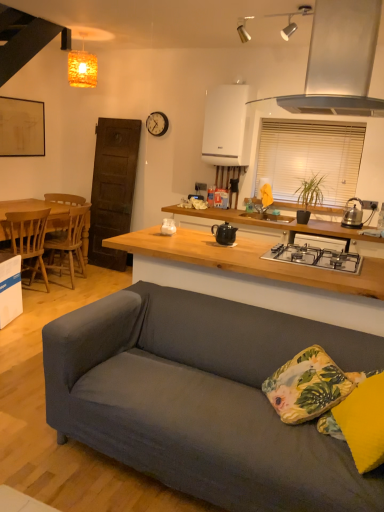
Measure the distance between wooden chair at left, which is counted as the first chair, starting from the front, and camera.

The distance of wooden chair at left, which is counted as the first chair, starting from the front, from camera is 12.43 feet.

I want to click on green matte plant at upper right, so click(x=309, y=197).

The image size is (384, 512). Identify the location of black ceramic teapot at center. (224, 233).

Locate an element on the screen. This screenshot has height=512, width=384. matte yellow pillow at lower right, the 2th pillow viewed from the back is located at coordinates (364, 422).

From a real-world perspective, is white glossy coffee cup at center beneath black ceramic teapot at center?

Correct, in the physical world, white glossy coffee cup at center is lower than black ceramic teapot at center.

Can you confirm if white glossy coffee cup at center is taller than black ceramic teapot at center?

No, white glossy coffee cup at center is not taller than black ceramic teapot at center.

From the image's perspective, who appears lower, white glossy coffee cup at center or black ceramic teapot at center?

black ceramic teapot at center.

Is point (171, 229) closer to camera compared to point (217, 238)?

No, it is behind (217, 238).

From a real-world perspective, who is located higher, metallic black kettle at right or white glossy cabinet at upper center?

white glossy cabinet at upper center.

In terms of width, does metallic black kettle at right look wider or thinner when compared to white glossy cabinet at upper center?

metallic black kettle at right is thinner than white glossy cabinet at upper center.

Considering the relative positions of metallic black kettle at right and white glossy cabinet at upper center in the image provided, is metallic black kettle at right to the left of white glossy cabinet at upper center from the viewer's perspective?

Incorrect, metallic black kettle at right is not on the left side of white glossy cabinet at upper center.

Does metallic black kettle at right come behind white glossy cabinet at upper center?

No, metallic black kettle at right is in front of white glossy cabinet at upper center.

Which is behind, white glossy coffee cup at center or white cardboard box at lower left?

white cardboard box at lower left is further away from the camera.

From the picture: Is there a large distance between white glossy coffee cup at center and white cardboard box at lower left?

Yes, white glossy coffee cup at center is far from white cardboard box at lower left.

Could white cardboard box at lower left be considered to be inside white glossy coffee cup at center?

No, white cardboard box at lower left is located outside of white glossy coffee cup at center.

How many degrees apart are the facing directions of green matte plant at upper right and white glossy coffee cup at center?

180 degrees separate the facing orientations of green matte plant at upper right and white glossy coffee cup at center.

Image resolution: width=384 pixels, height=512 pixels. I want to click on coffee cup located underneath the green matte plant at upper right (from a real-world perspective), so click(x=168, y=226).

Looking at this image, is green matte plant at upper right situated inside white glossy coffee cup at center or outside?

green matte plant at upper right is not enclosed by white glossy coffee cup at center.

Is point (315, 196) more distant than point (169, 228)?

Yes, point (315, 196) is behind point (169, 228).

Considering the positions of point (350, 399) and point (360, 202), is point (350, 399) closer or farther from the camera than point (360, 202)?

Clearly, point (350, 399) is closer to the camera than point (360, 202).

Is matte yellow pillow at lower right, the 2th pillow viewed from the back, bigger or smaller than metallic black kettle at right?

In the image, matte yellow pillow at lower right, the 2th pillow viewed from the back, appears to be larger than metallic black kettle at right.

Is matte yellow pillow at lower right, the 2th pillow viewed from the back, next to metallic black kettle at right?

No, matte yellow pillow at lower right, the 2th pillow viewed from the back, is not in contact with metallic black kettle at right.

In the scene shown: Between wooden table at left and matte yellow pillow at lower right, the 2th pillow viewed from the back, which one has larger size?

wooden table at left.

From a real-world perspective, does wooden table at left stand above matte yellow pillow at lower right, the 2th pillow viewed from the back?

No, from a real-world perspective, wooden table at left is not above matte yellow pillow at lower right, the 2th pillow viewed from the back.

How many degrees apart are the facing directions of wooden table at left and matte yellow pillow at lower right, the 2th pillow viewed from the back?

158 degrees separate the facing orientations of wooden table at left and matte yellow pillow at lower right, the 2th pillow viewed from the back.

Considering the relative sizes of wooden table at left and matte yellow pillow at lower right, the first pillow from the front, in the image provided, is wooden table at left wider than matte yellow pillow at lower right, the first pillow from the front,?

Yes, wooden table at left is wider than matte yellow pillow at lower right, the first pillow from the front.

Is orange textured cube at upper center facing away from white wooden clock at upper center?

orange textured cube at upper center does not have its back to white wooden clock at upper center.

Does point (83, 72) lie in front of point (147, 121)?

Yes, it is in front of point (147, 121).

Considering the relative sizes of orange textured cube at upper center and white wooden clock at upper center in the image provided, is orange textured cube at upper center taller than white wooden clock at upper center?

Yes.

Identify the location of appliance above the white glossy coffee cup at center (from a real-world perspective). Image resolution: width=384 pixels, height=512 pixels. (224, 233).

I want to click on coffee maker in front of the white glossy cabinet at upper center, so click(x=352, y=215).

When comparing their distances from black ceramic teapot at center, does black matte gas stove at center or white cardboard box at lower left seem closer?

black matte gas stove at center is closer to black ceramic teapot at center.

Looking at this image, looking at the image, which one is located closer to white cardboard box at lower left, orange textured cube at upper center or wooden chair at left, which is the 2th chair from back to front?

The object closer to white cardboard box at lower left is wooden chair at left, which is the 2th chair from back to front.

From the picture: Based on their spatial positions, is matte yellow pillow at lower right, the first pillow from the front, or black matte gas stove at center closer to white wooden clock at upper center?

Based on the image, black matte gas stove at center appears to be nearer to white wooden clock at upper center.

Based on their spatial positions, is wooden chair at left, which is counted as the first chair, starting from the front, or orange textured cube at upper center further from metallic black kettle at right?

orange textured cube at upper center.

Looking at the image, which one is located further to wooden chair at left, which is counted as the first chair, starting from the front, wooden table at left or satin silver range hood at upper right?

Result: satin silver range hood at upper right lies further to wooden chair at left, which is counted as the first chair, starting from the front, than the other object.

Considering their positions, is orange textured cube at upper center positioned further to matte yellow pillow at lower right, the first pillow from the front, than wooden chair at left, the first chair positioned from the back?

Among the two, orange textured cube at upper center is located further to matte yellow pillow at lower right, the first pillow from the front.

Estimate the real-world distances between objects in this image. Which object is further from matte yellow pillow at lower right, the first pillow from the front, satin silver range hood at upper right or white glossy coffee cup at center?

Among the two, white glossy coffee cup at center is located further to matte yellow pillow at lower right, the first pillow from the front.

From the picture: Estimate the real-world distances between objects in this image. Which object is closer to orange textured cube at upper center, wooden table at left or dark gray fabric couch at center?

wooden table at left is closer to orange textured cube at upper center.

Identify the location of gas stove located between wooden chair at left, which is the 2th chair from back to front, and green matte plant at upper right in the left-right direction. (316, 257).

Locate an element on the screen. This screenshot has height=512, width=384. cabinetry between satin silver range hood at upper right and white blinds at upper right in the front-back direction is located at coordinates (227, 126).

This screenshot has height=512, width=384. Identify the location of pillow between matte yellow pillow at lower right, the first pillow from the front, and white blinds at upper right, along the z-axis. (308, 386).

Image resolution: width=384 pixels, height=512 pixels. Identify the location of cardboard box between wooden table at left and green matte plant at upper right. (10, 289).